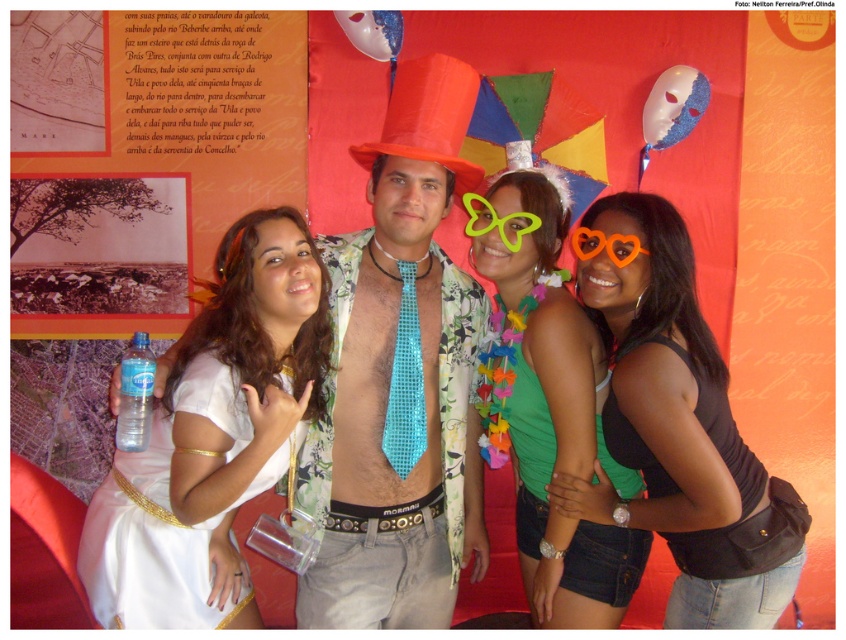
Measure the distance from shiny plastic party hat at center to orange heart-shaped goggles at center.

16.44 inches

Is shiny plastic party hat at center above orange heart-shaped goggles at center?

Indeed, shiny plastic party hat at center is positioned over orange heart-shaped goggles at center.

Who is more distant from viewer, [391,104] or [610,244]?

Point [391,104]

At what (x,y) coordinates should I click in order to perform the action: click on shiny plastic party hat at center. Please return your answer as a coordinate pair (x, y). This screenshot has height=640, width=846. Looking at the image, I should click on (427, 116).

Is point (533, 221) positioned in front of point (588, 244)?

Yes, point (533, 221) is in front of point (588, 244).

Between point (467, 205) and point (630, 260), which one is positioned behind?

The point (467, 205) is more distant.

Where is `green plastic butterfly at center`? This screenshot has height=640, width=846. green plastic butterfly at center is located at coordinates (497, 221).

Can you confirm if shiny blue tie at center is positioned to the left of green fabric top at center?

Correct, you'll find shiny blue tie at center to the left of green fabric top at center.

Who is more forward, (x=470, y=168) or (x=537, y=208)?

Point (x=470, y=168) is more forward.

Locate an element on the screen. shiny blue tie at center is located at coordinates (400, 378).